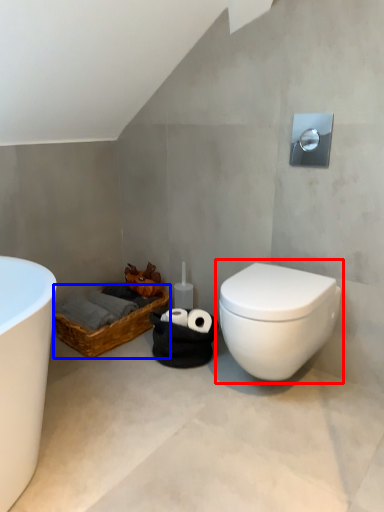
Question: Which of the following is the closest to the observer, toilet (highlighted by a red box) or basket (highlighted by a blue box)?

Choices:
 (A) toilet
 (B) basket

Answer: (A)